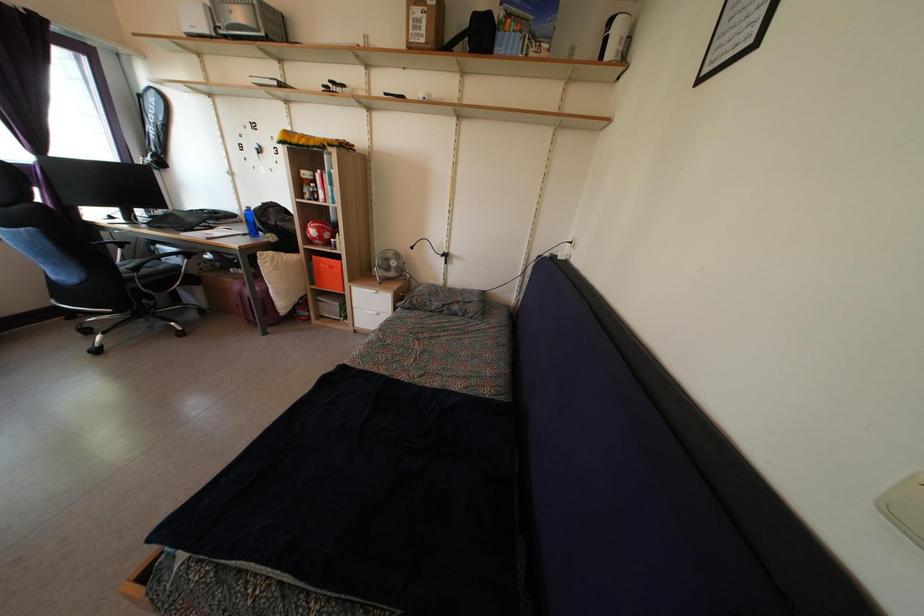
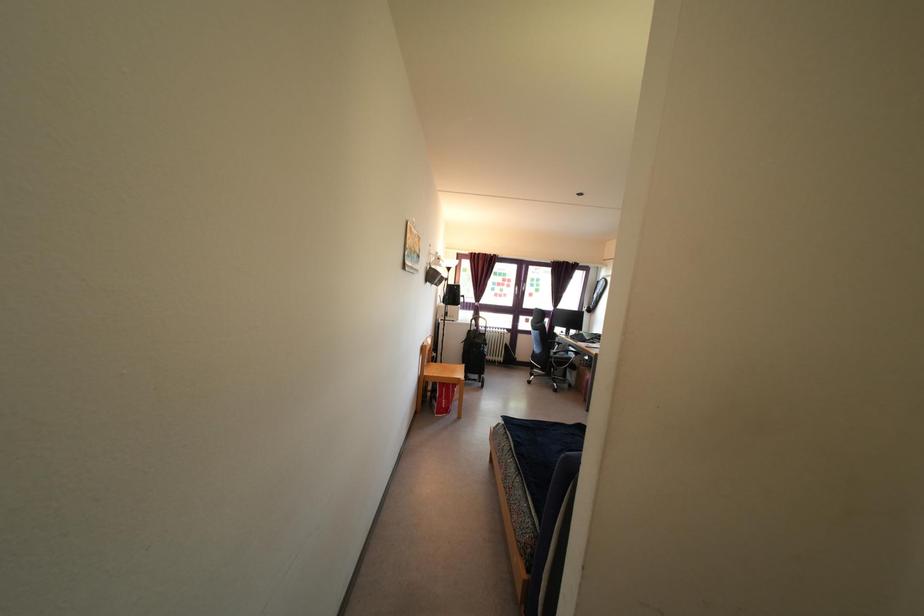
Question: I am providing you with two images of the same scene from different viewpoints. Which of the following objects are not visible in image2?

Choices:
 (A) chair sitting surface
 (B) chair armrest
 (C) sofa sitting surface
 (D) none of these

Answer: (D)